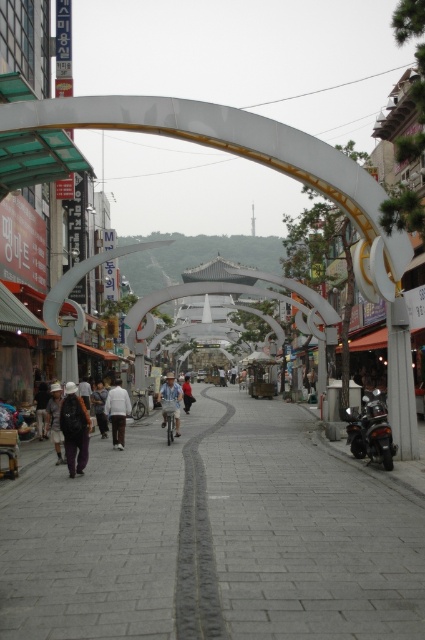
Does dark gray backpack at lower left appear over light blue denim jacket at center?

Correct, dark gray backpack at lower left is located above light blue denim jacket at center.

Does dark gray backpack at lower left appear under light blue denim jacket at center?

No, dark gray backpack at lower left is not below light blue denim jacket at center.

The height and width of the screenshot is (640, 425). I want to click on dark gray backpack at lower left, so click(x=42, y=410).

Which of these two, shiny black motorcycle at lower right or dark gray backpack at center, stands shorter?

With less height is shiny black motorcycle at lower right.

From the picture: Does shiny black motorcycle at lower right have a greater height compared to dark gray backpack at center?

Incorrect, shiny black motorcycle at lower right's height is not larger of dark gray backpack at center's.

Who is more forward, (365, 400) or (73, 417)?

Positioned in front is point (73, 417).

What are the coordinates of `shiny black motorcycle at lower right` in the screenshot? It's located at (371, 429).

Which is above, dark gray backpack at lower left or dark gray pants at center?

dark gray backpack at lower left is higher up.

Can you confirm if dark gray backpack at lower left is positioned below dark gray pants at center?

Incorrect, dark gray backpack at lower left is not positioned below dark gray pants at center.

The width and height of the screenshot is (425, 640). What are the coordinates of `dark gray backpack at lower left` in the screenshot? It's located at (42, 410).